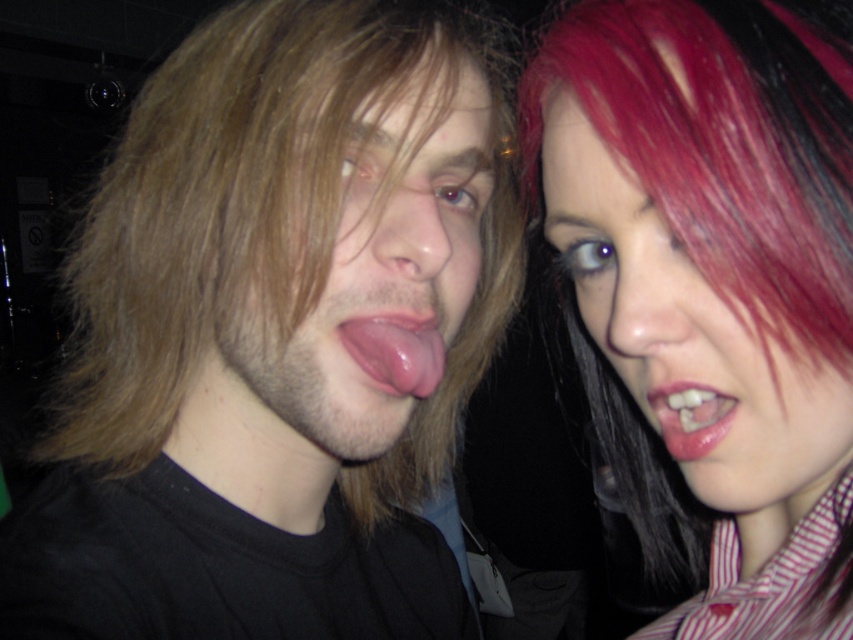
Between shiny pink hair at upper right and glossy pink lips at upper right, which one has less height?

glossy pink lips at upper right

Is shiny pink hair at upper right closer to camera compared to glossy pink lips at upper right?

Yes, it is.

What do you see at coordinates (688, 332) in the screenshot?
I see `shiny pink hair at upper right` at bounding box center [688, 332].

Where is `shiny pink hair at upper right`? Image resolution: width=853 pixels, height=640 pixels. shiny pink hair at upper right is located at coordinates (688, 332).

Does matte black shirt at left have a larger size compared to pink flesh tongue at center?

Indeed, matte black shirt at left has a larger size compared to pink flesh tongue at center.

Can you confirm if matte black shirt at left is positioned to the left of pink flesh tongue at center?

Yes, matte black shirt at left is to the left of pink flesh tongue at center.

Is point (469, 336) farther from camera compared to point (399, 376)?

Yes, point (469, 336) is behind point (399, 376).

Where is `matte black shirt at left`? This screenshot has width=853, height=640. matte black shirt at left is located at coordinates (271, 337).

Does shiny pink hair at upper right have a lesser height compared to pink flesh tongue at center?

Incorrect, shiny pink hair at upper right's height does not fall short of pink flesh tongue at center's.

The height and width of the screenshot is (640, 853). Find the location of `shiny pink hair at upper right`. shiny pink hair at upper right is located at coordinates (688, 332).